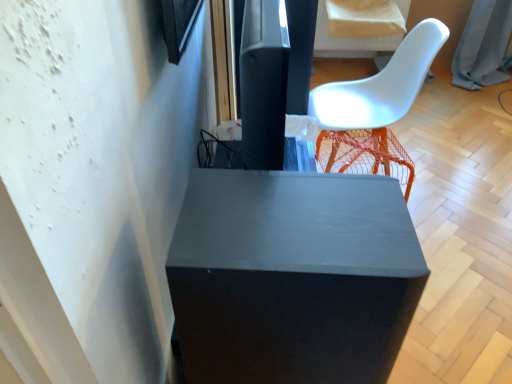
Question: Considering the relative sizes of matte black speaker at upper center and white plastic chair at upper right in the image provided, is matte black speaker at upper center wider than white plastic chair at upper right?

Choices:
 (A) no
 (B) yes

Answer: (A)

Question: Is matte black speaker at upper center at the right side of white plastic chair at upper right?

Choices:
 (A) no
 (B) yes

Answer: (A)

Question: Can you confirm if matte black speaker at upper center is thinner than white plastic chair at upper right?

Choices:
 (A) yes
 (B) no

Answer: (A)

Question: From a real-world perspective, does matte black speaker at upper center sit lower than white plastic chair at upper right?

Choices:
 (A) no
 (B) yes

Answer: (A)

Question: Is matte black speaker at upper center oriented away from white plastic chair at upper right?

Choices:
 (A) no
 (B) yes

Answer: (A)

Question: From the image's perspective, is matte black speaker at upper center located above white plastic chair at upper right?

Choices:
 (A) yes
 (B) no

Answer: (A)

Question: Considering the relative sizes of orange mesh stool at right and white plastic chair at upper right in the image provided, is orange mesh stool at right taller than white plastic chair at upper right?

Choices:
 (A) no
 (B) yes

Answer: (A)

Question: Is orange mesh stool at right at the left side of white plastic chair at upper right?

Choices:
 (A) no
 (B) yes

Answer: (B)

Question: Considering the relative positions of orange mesh stool at right and white plastic chair at upper right in the image provided, is orange mesh stool at right in front of white plastic chair at upper right?

Choices:
 (A) no
 (B) yes

Answer: (A)

Question: From a real-world perspective, is orange mesh stool at right over white plastic chair at upper right?

Choices:
 (A) no
 (B) yes

Answer: (A)

Question: Considering the relative sizes of orange mesh stool at right and white plastic chair at upper right in the image provided, is orange mesh stool at right thinner than white plastic chair at upper right?

Choices:
 (A) no
 (B) yes

Answer: (B)

Question: Is orange mesh stool at right wider than white plastic chair at upper right?

Choices:
 (A) no
 (B) yes

Answer: (A)

Question: Is orange mesh stool at right taller than matte black speaker at upper center?

Choices:
 (A) no
 (B) yes

Answer: (A)